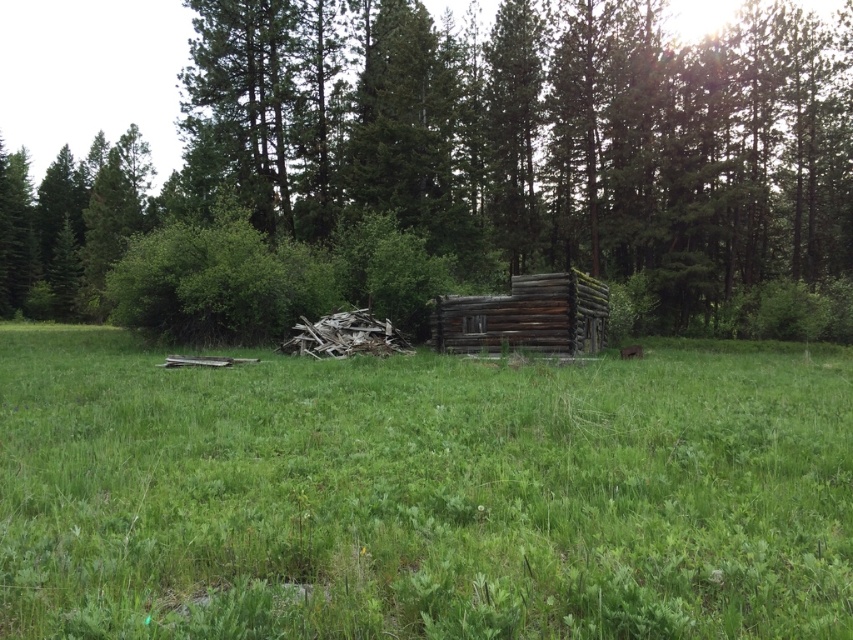
Can you confirm if weathered wood cabin at center is positioned to the left of weathered wood log cabin at center?

Yes, weathered wood cabin at center is to the left of weathered wood log cabin at center.

Is weathered wood cabin at center further to camera compared to weathered wood log cabin at center?

Yes.

In order to click on weathered wood cabin at center in this screenshot , I will do `click(460, 172)`.

Where is `weathered wood cabin at center`? This screenshot has height=640, width=853. weathered wood cabin at center is located at coordinates (460, 172).

At what (x,y) coordinates should I click in order to perform the action: click on green grassy at center. Please return your answer as a coordinate pair (x, y). This screenshot has width=853, height=640. Looking at the image, I should click on [x=421, y=493].

This screenshot has width=853, height=640. In order to click on green grassy at center in this screenshot , I will do `click(421, 493)`.

Is green grassy at center further to camera compared to weathered wood log cabin at center?

That is False.

Can you confirm if green grassy at center is positioned to the left of weathered wood log cabin at center?

Yes, green grassy at center is to the left of weathered wood log cabin at center.

Is point (347, 515) positioned behind point (496, 333)?

No, it is not.

Identify the location of green grassy at center. (421, 493).